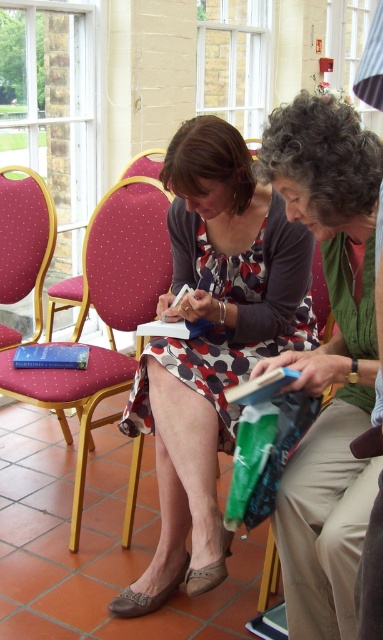
You are an event organizer who needs to arrange seating for two attendees wearing a polka dot dress at center and a green knitted sweater at center. Based on their clothing sizes, which attendee requires a larger chair?

The polka dot dress at center requires a larger chair because it has a larger size compared to the green knitted sweater at center.

You are organizing a book signing event and need to ensure that the green knitted sweater at center and the blue hardcover book at center can fit side by side on a display table that is 1 meter wide. Based on their sizes, will they both fit comfortably?

The green knitted sweater at center is wider than the blue hardcover book at center. However, without specific measurements, it is impossible to determine if their combined width exceeds 1 meter. Additional information about their individual dimensions is needed to confirm.

You are organizing a book signing event and need to ensure that the green knitted sweater at center and the blue hardcover book at center are visible to attendees. Based on their positions, which item is placed higher?

The green knitted sweater at center is above the blue hardcover book at center, so it is placed higher and would be more visible to attendees.